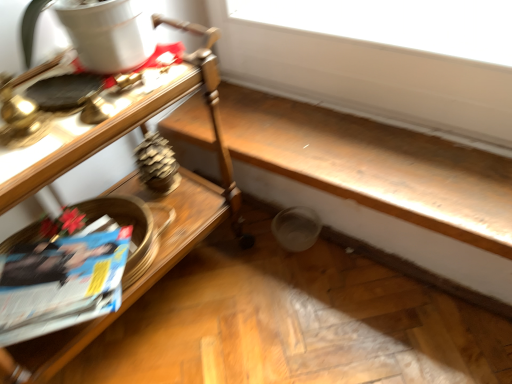
I want to click on free spot to the right of wooden table at left, so click(300, 311).